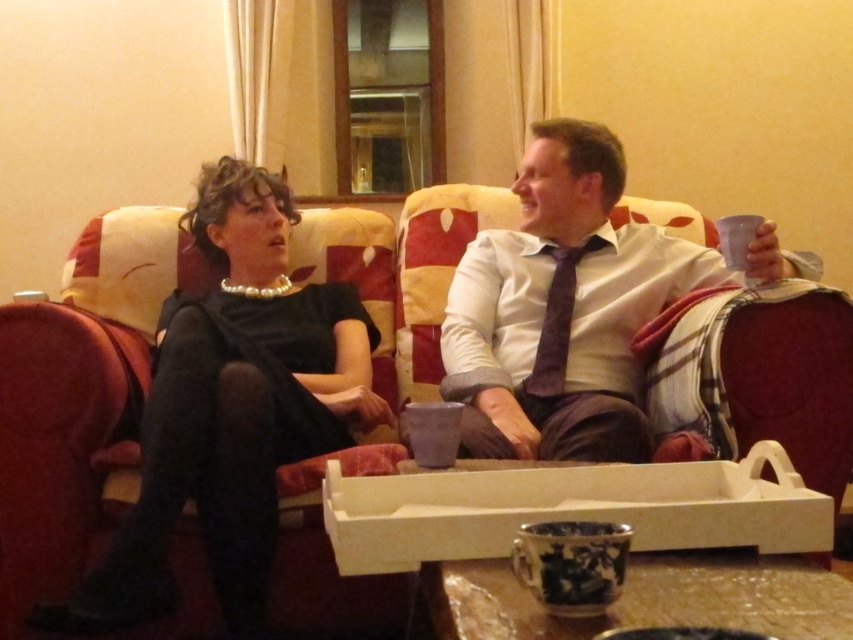
Based on the photo, which is above, velvet-like beige couch at center or purple velvet tie at center?

purple velvet tie at center is higher up.

Is velvet-like beige couch at center thinner than purple velvet tie at center?

Incorrect, velvet-like beige couch at center's width is not less than purple velvet tie at center's.

Which is in front, point (131, 348) or point (524, 380)?

Point (131, 348) is more forward.

Locate an element on the screen. This screenshot has height=640, width=853. velvet-like beige couch at center is located at coordinates (78, 404).

Does velvet-like beige couch at center appear over black satin dress at center?

Yes, velvet-like beige couch at center is above black satin dress at center.

Does point (833, 451) come behind point (369, 403)?

No.

Find the location of a particular element. The height and width of the screenshot is (640, 853). velvet-like beige couch at center is located at coordinates (78, 404).

Does velvet-like beige couch at center appear over matte white shirt at center?

Actually, velvet-like beige couch at center is below matte white shirt at center.

Between point (135, 337) and point (496, 417), which one is positioned behind?

The point (135, 337) is more distant.

In order to click on velvet-like beige couch at center in this screenshot , I will do `click(78, 404)`.